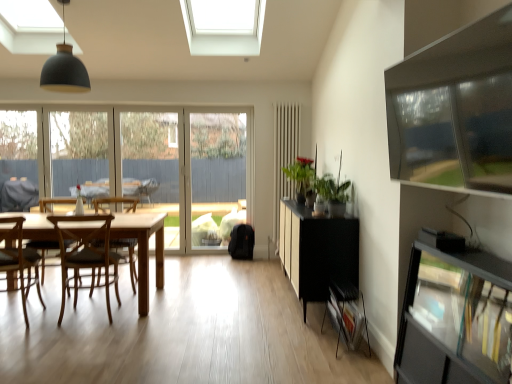
Question: Is transparent glass shelf at right thinner than matte black pendant lamp at upper left?

Choices:
 (A) no
 (B) yes

Answer: (B)

Question: From the image's perspective, does transparent glass shelf at right appear lower than matte black pendant lamp at upper left?

Choices:
 (A) no
 (B) yes

Answer: (B)

Question: Is the position of transparent glass shelf at right more distant than that of matte black pendant lamp at upper left?

Choices:
 (A) yes
 (B) no

Answer: (B)

Question: Is the position of transparent glass shelf at right less distant than that of matte black pendant lamp at upper left?

Choices:
 (A) yes
 (B) no

Answer: (A)

Question: Would you say transparent glass shelf at right contains matte black pendant lamp at upper left?

Choices:
 (A) yes
 (B) no

Answer: (B)

Question: From the image's perspective, is transparent glass shelf at right located above matte black pendant lamp at upper left?

Choices:
 (A) no
 (B) yes

Answer: (A)

Question: Is clear glass window frame at left, the 2th window frame viewed from the right, at the right side of clear glass door at center?

Choices:
 (A) yes
 (B) no

Answer: (B)

Question: Considering the relative sizes of clear glass window frame at left, the first window frame when ordered from left to right, and clear glass door at center in the image provided, is clear glass window frame at left, the first window frame when ordered from left to right, taller than clear glass door at center?

Choices:
 (A) no
 (B) yes

Answer: (A)

Question: From the image's perspective, does clear glass window frame at left, the first window frame when ordered from left to right, appear lower than clear glass door at center?

Choices:
 (A) yes
 (B) no

Answer: (B)

Question: Is clear glass window frame at left, the first window frame when ordered from left to right, wider than clear glass door at center?

Choices:
 (A) yes
 (B) no

Answer: (B)

Question: Can we say clear glass window frame at left, the 2th window frame viewed from the right, lies outside clear glass door at center?

Choices:
 (A) yes
 (B) no

Answer: (A)

Question: Is clear glass window frame at left, the 2th window frame viewed from the right, directly adjacent to clear glass door at center?

Choices:
 (A) no
 (B) yes

Answer: (A)

Question: From the image's perspective, is wooden chair at left, which is the 1th chair in front-to-back order, beneath transparent glass shelf at right?

Choices:
 (A) no
 (B) yes

Answer: (A)